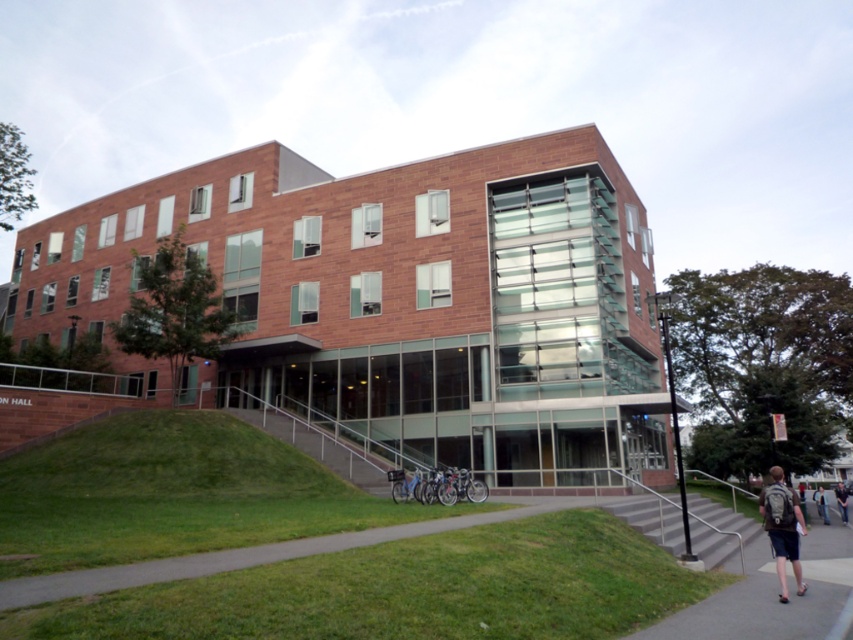
Question: Considering the real-world distances, which object is closest to the metallic gray staircase at lower right?

Choices:
 (A) gray backpack at lower right
 (B) light blue jeans at lower right
 (C) dark blue jeans at lower right

Answer: (A)

Question: Is metallic gray staircase at lower right to the right of dark blue jeans at lower right from the viewer's perspective?

Choices:
 (A) no
 (B) yes

Answer: (A)

Question: Is gray backpack at lower right wider than light blue jeans at lower right?

Choices:
 (A) yes
 (B) no

Answer: (B)

Question: Is metallic gray staircase at lower right bigger than dark blue jeans at lower right?

Choices:
 (A) no
 (B) yes

Answer: (A)

Question: Which of the following is the closest to the observer?

Choices:
 (A) light blue jeans at lower right
 (B) dark blue jeans at lower right

Answer: (A)

Question: Which of the following is the closest to the observer?

Choices:
 (A) (775, 480)
 (B) (820, 488)

Answer: (A)